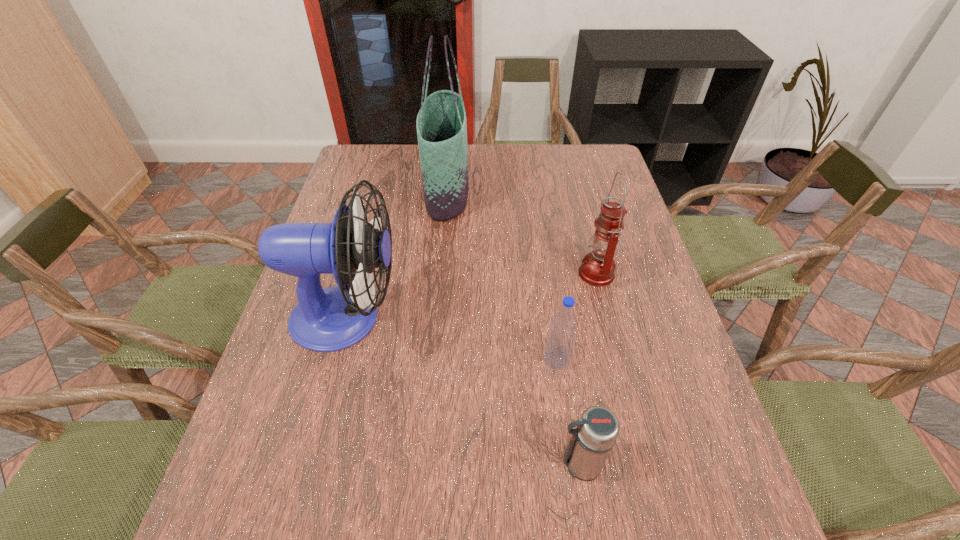
Where is `free space between the water bottle and the shortest object`? free space between the water bottle and the shortest object is located at coordinates (568, 411).

Where is `empty space that is in between the water bottle and the tote bag`? Image resolution: width=960 pixels, height=540 pixels. empty space that is in between the water bottle and the tote bag is located at coordinates (501, 275).

The height and width of the screenshot is (540, 960). What are the coordinates of `object that is the nearest to the water bottle` in the screenshot? It's located at (591, 442).

At what (x,y) coordinates should I click in order to perform the action: click on object that is the nearest to the water bottle. Please return your answer as a coordinate pair (x, y). Looking at the image, I should click on (591, 442).

Image resolution: width=960 pixels, height=540 pixels. I want to click on blank space that satisfies the following two spatial constraints: 1. on the back side of the water bottle; 2. in front of the leftmost object where the airflow is directed, so click(551, 318).

Identify the location of free space that satisfies the following two spatial constraints: 1. in front of the fan where the airflow is directed; 2. on the left side of the water bottle. Image resolution: width=960 pixels, height=540 pixels. (335, 359).